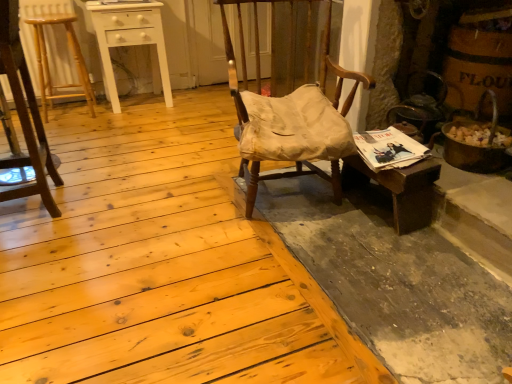
Locate an element on the screen. This screenshot has height=384, width=512. free space that is in between wooden chair with worn fabric cushion at center, the first chair in the right-to-left sequence, and wooden desk at right is located at coordinates (326, 228).